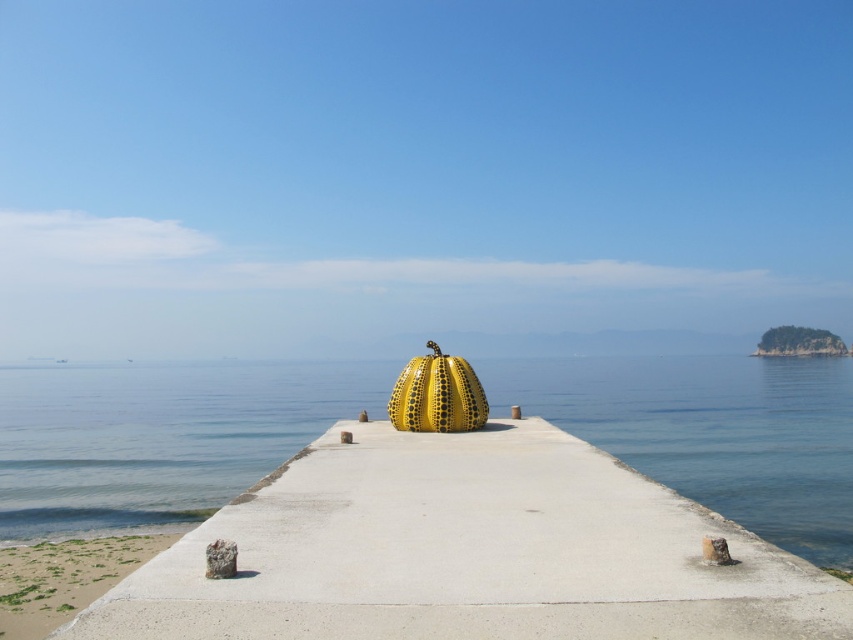
Is the position of transparent blue water at center more distant than that of green grassy sand at lower left?

That is False.

Which is behind, point (737, 381) or point (64, 596)?

Positioned behind is point (737, 381).

I want to click on transparent blue water at center, so click(x=160, y=436).